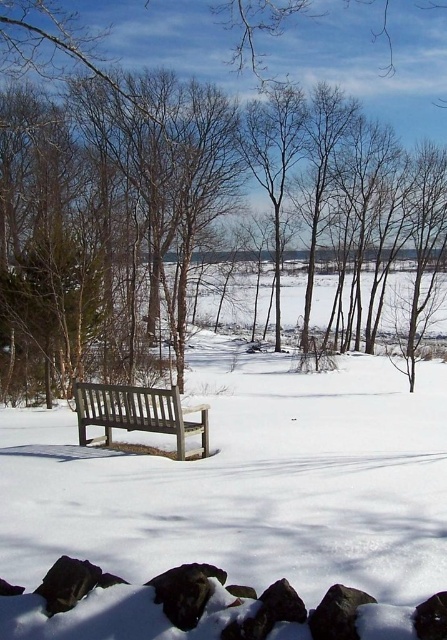
Question: Among these objects, which one is nearest to the camera?

Choices:
 (A) wooden bench at center
 (B) white matte bench at center
 (C) brown wood bench at lower left

Answer: (B)

Question: Which of the following is the closest to the observer?

Choices:
 (A) (9, 157)
 (B) (106, 419)
 (C) (239, 524)

Answer: (C)

Question: Which point is farther to the camera?

Choices:
 (A) wooden bench at center
 (B) brown wood bench at lower left
 (C) white matte bench at center

Answer: (A)

Question: Is white matte bench at center closer to the viewer compared to wooden bench at center?

Choices:
 (A) yes
 (B) no

Answer: (A)

Question: Is brown wood bench at lower left to the right of white matte bench at center from the viewer's perspective?

Choices:
 (A) no
 (B) yes

Answer: (B)

Question: Does brown wood bench at lower left have a larger size compared to white matte bench at center?

Choices:
 (A) no
 (B) yes

Answer: (B)